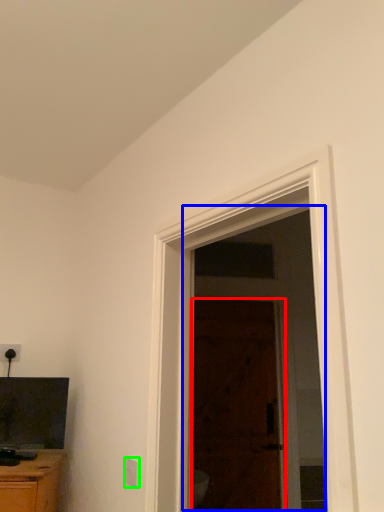
Question: Estimate the real-world distances between objects in this image. Which object is farther from door (highlighted by a red box), screen door (highlighted by a blue box) or electric outlet (highlighted by a green box)?

Choices:
 (A) screen door
 (B) electric outlet

Answer: (B)